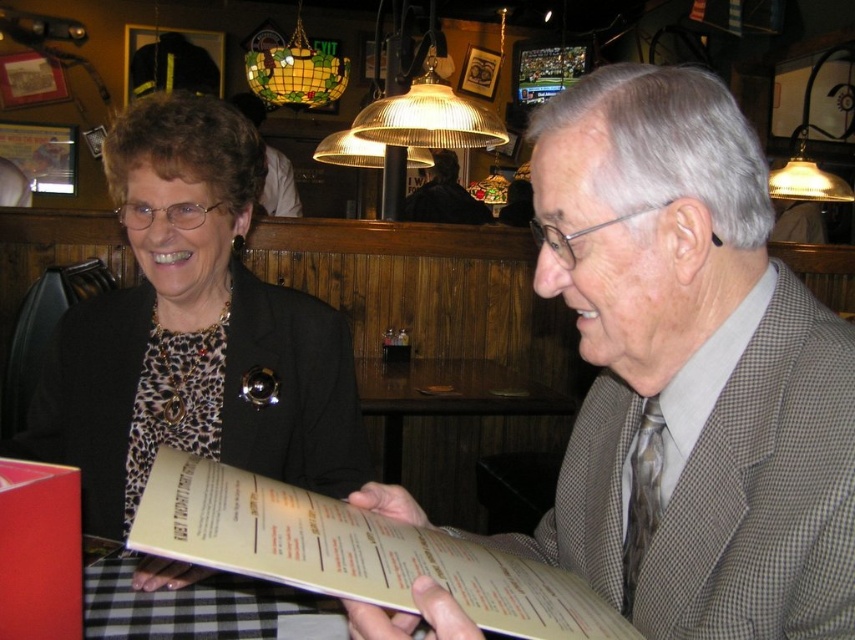
Question: Among these points, which one is nearest to the camera?

Choices:
 (A) (809, 513)
 (B) (422, 202)
 (C) (190, 609)
 (D) (337, 352)

Answer: (A)

Question: Does leopard print blouse at center have a lesser width compared to black checkered tablecloth at lower center?

Choices:
 (A) no
 (B) yes

Answer: (A)

Question: Considering the real-world distances, which object is farthest from the gray checkered suit at center?

Choices:
 (A) leopard print blouse at center
 (B) black checkered tablecloth at lower center

Answer: (A)

Question: Is leopard print blouse at center positioned behind black checkered tablecloth at lower center?

Choices:
 (A) yes
 (B) no

Answer: (A)

Question: Does beige paper menu at center have a lesser width compared to dark brown leather jacket at upper center?

Choices:
 (A) yes
 (B) no

Answer: (B)

Question: Which point is closer to the camera taking this photo?

Choices:
 (A) (222, 608)
 (B) (470, 218)

Answer: (A)